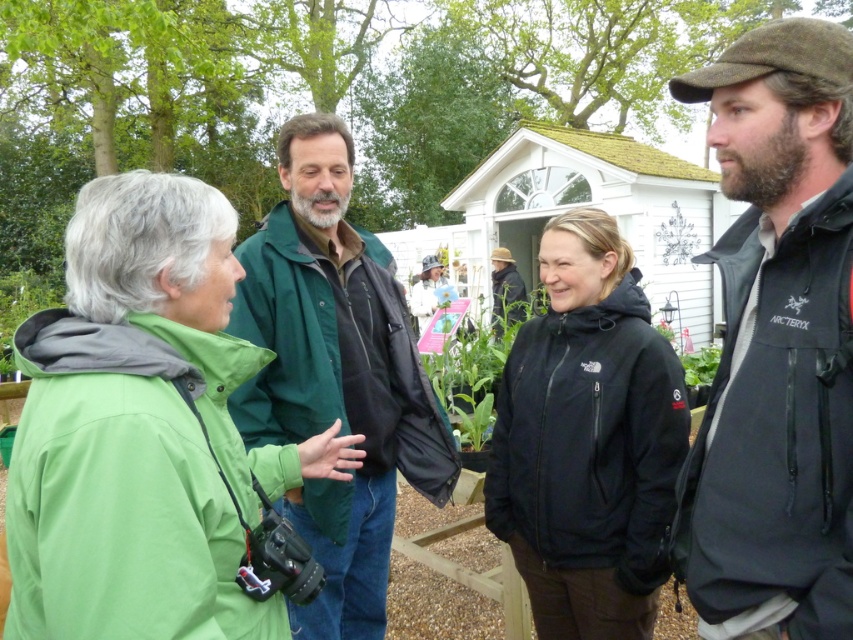
Question: Can you confirm if green softshell jacket at left is wider than green leafy plant at center?

Choices:
 (A) no
 (B) yes

Answer: (B)

Question: Estimate the real-world distances between objects in this image. Which object is farther from the dark brown wool cap at upper right?

Choices:
 (A) green matte jacket at center
 (B) green leafy plant at center
 (C) green leafy plant at upper left
 (D) black softshell jacket at center

Answer: (C)

Question: Is green softshell jacket at left to the left of dark brown leather jacket at center from the viewer's perspective?

Choices:
 (A) no
 (B) yes

Answer: (B)

Question: Estimate the real-world distances between objects in this image. Which object is closer to the black softshell jacket at center?

Choices:
 (A) dark brown wool cap at upper right
 (B) green leafy plant at upper left
 (C) dark brown leather jacket at center
 (D) green leafy plant at center

Answer: (A)

Question: Is green softshell jacket at left to the left of dark brown wool cap at upper right from the viewer's perspective?

Choices:
 (A) yes
 (B) no

Answer: (A)

Question: Which of these objects is positioned closest to the green leafy plant at center?

Choices:
 (A) dark brown leather jacket at center
 (B) green softshell jacket at left
 (C) green matte jacket at center

Answer: (C)